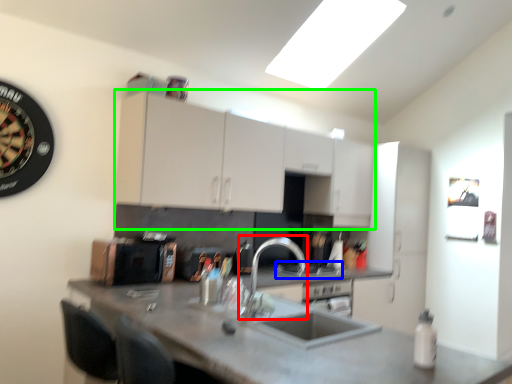
Question: Which object is the farthest from faucet (highlighted by a red box)? Choose among these: gas stove (highlighted by a blue box) or cabinetry (highlighted by a green box).

Choices:
 (A) gas stove
 (B) cabinetry

Answer: (B)